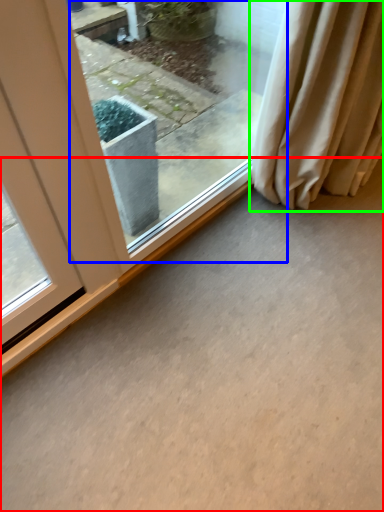
Question: Which object is the farthest from concrete (highlighted by a red box)? Choose among these: window (highlighted by a blue box) or curtain (highlighted by a green box).

Choices:
 (A) window
 (B) curtain

Answer: (A)